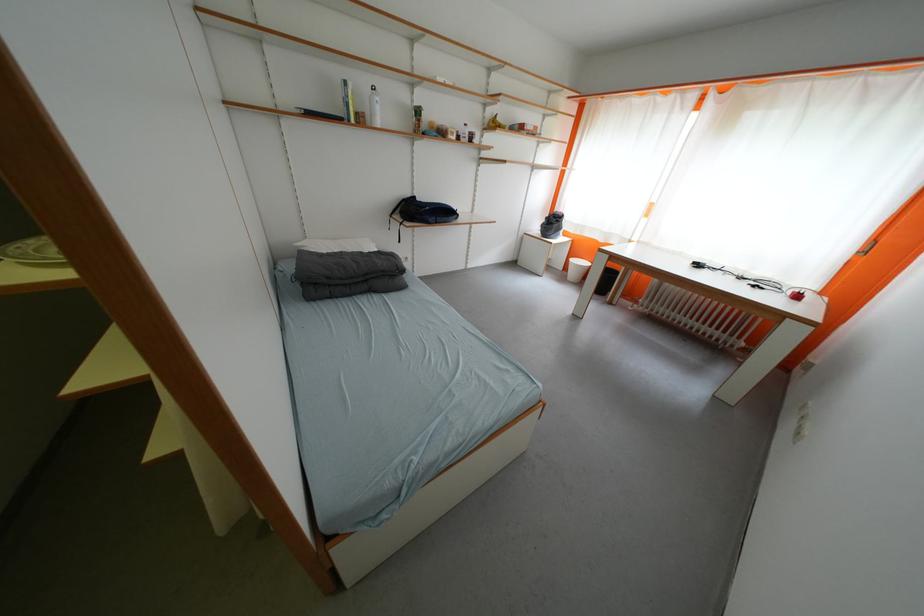
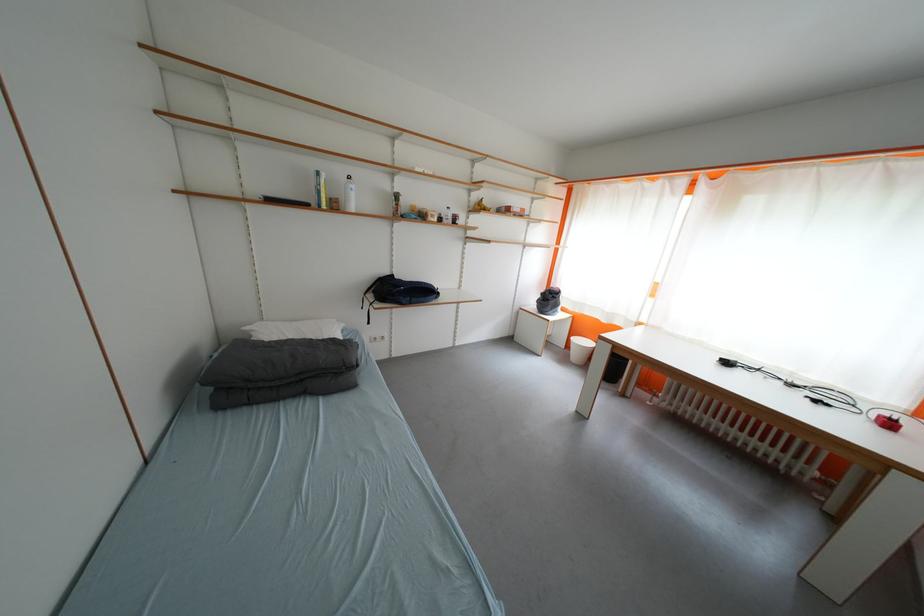
In the second image, find the point that corresponds to point 371,124 in the first image.

(344, 209)